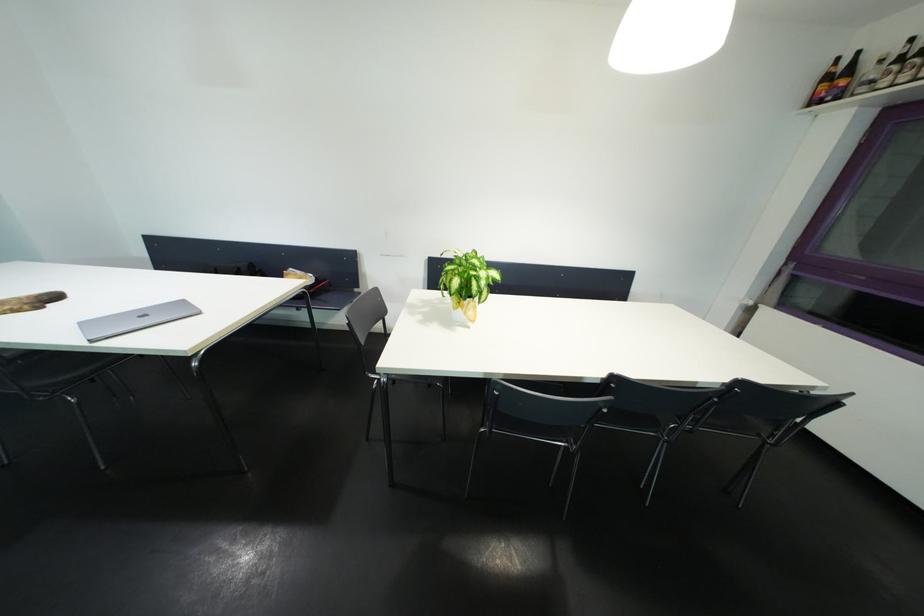
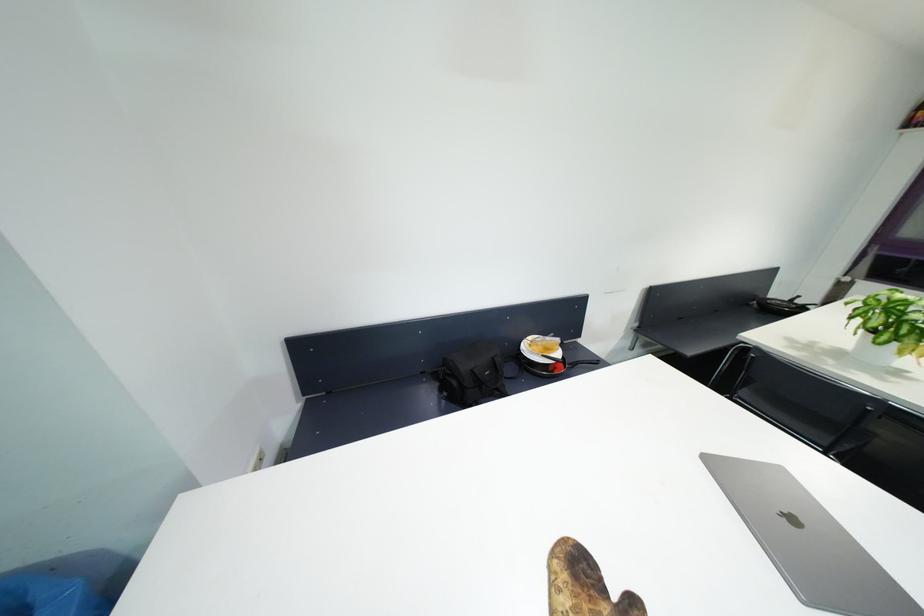
Question: What movement of the cameraman would produce the second image?

Choices:
 (A) Left
 (B) Right
 (C) Forward
 (D) Backward

Answer: (A)